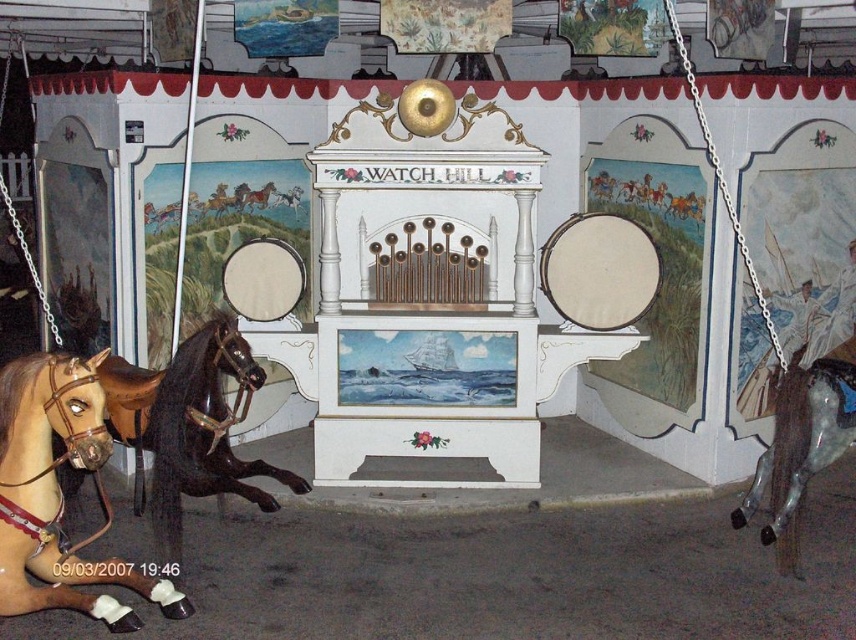
In the scene shown: Which of these two, brown glossy horse at left or shiny metallic horse at right, stands shorter?

shiny metallic horse at right

Describe the element at coordinates (189, 424) in the screenshot. I see `brown glossy horse at left` at that location.

Image resolution: width=856 pixels, height=640 pixels. Find the location of `brown glossy horse at left`. brown glossy horse at left is located at coordinates (189, 424).

Who is lower down, brown glossy horse at lower left or brown glossy horse at left?

brown glossy horse at lower left is lower down.

Who is shorter, brown glossy horse at lower left or brown glossy horse at left?

Standing shorter between the two is brown glossy horse at lower left.

This screenshot has height=640, width=856. Find the location of `brown glossy horse at lower left`. brown glossy horse at lower left is located at coordinates (58, 493).

Does brown glossy horse at lower left have a smaller size compared to shiny metallic horse at right?

No.

Can you confirm if brown glossy horse at lower left is positioned above shiny metallic horse at right?

Incorrect, brown glossy horse at lower left is not positioned above shiny metallic horse at right.

Find the location of `brown glossy horse at lower left`. brown glossy horse at lower left is located at coordinates (58, 493).

At what (x,y) coordinates should I click in order to perform the action: click on brown glossy horse at lower left. Please return your answer as a coordinate pair (x, y). Looking at the image, I should click on (58, 493).